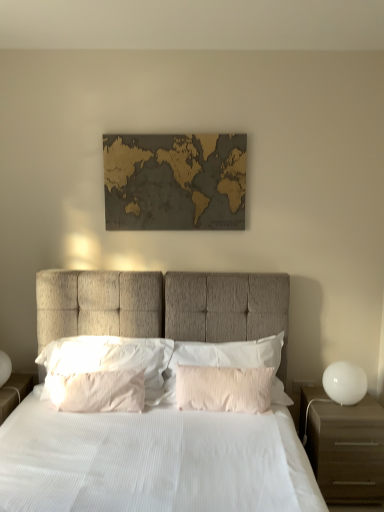
Question: Looking at their shapes, would you say pink textured pillow at center, positioned as the 2th pillow in left-to-right order, is wider or thinner than brown matte nightstand at right?

Choices:
 (A) wide
 (B) thin

Answer: (B)

Question: In terms of height, does pink textured pillow at center, which appears as the third pillow when viewed from the right, look taller or shorter compared to brown matte nightstand at right?

Choices:
 (A) tall
 (B) short

Answer: (B)

Question: Based on their relative distances, which object is nearer to the pearly white satin pillow at center, arranged as the 3th pillow when viewed from the left?

Choices:
 (A) pink textured pillow at center, marked as the 4th pillow in a left-to-right arrangement
 (B) white fabric bed at center
 (C) brown matte nightstand at right
 (D) wooden map at center
 (E) white soft pillow at center, which is the 1th pillow in left-to-right order

Answer: (A)

Question: Estimate the real-world distances between objects in this image. Which object is closer to the wooden map at center?

Choices:
 (A) brown matte nightstand at right
 (B) pink textured pillow at center, which appears as the third pillow when viewed from the right
 (C) white fabric bed at center
 (D) pink textured pillow at center, the first pillow positioned from the right
 (E) white glossy sphere at right

Answer: (D)